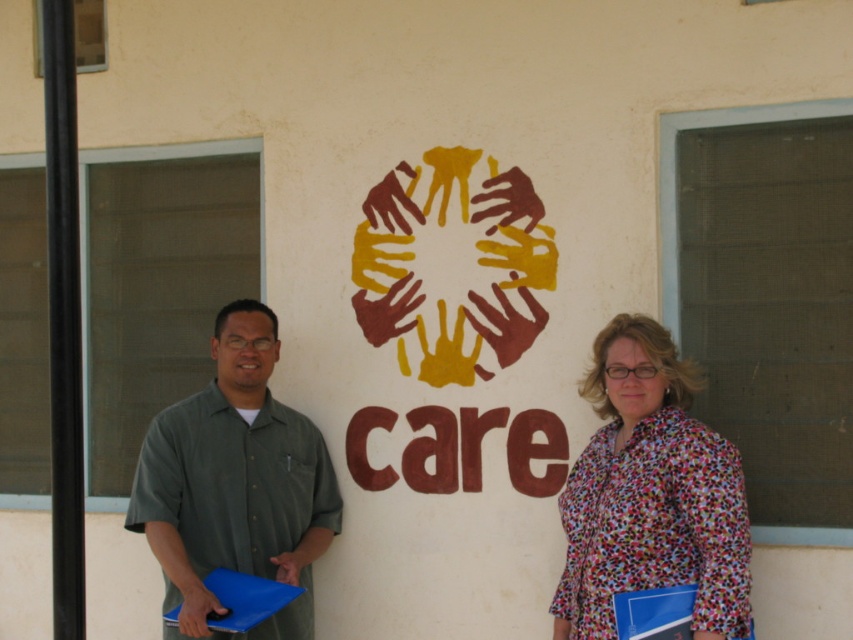
Can you confirm if green shirt at left is taller than green fabric shirt at left?

No.

Can you confirm if green shirt at left is bigger than green fabric shirt at left?

Actually, green shirt at left might be smaller than green fabric shirt at left.

Does point (662, 524) lie in front of point (213, 636)?

Yes, point (662, 524) is closer to viewer.

The height and width of the screenshot is (640, 853). Identify the location of green shirt at left. (651, 493).

Find the location of a particular element. Image resolution: width=853 pixels, height=640 pixels. printed fabric blouse at center is located at coordinates (650, 493).

Who is more forward, (712, 621) or (264, 308)?

Point (712, 621) is more forward.

You are a GUI agent. You are given a task and a screenshot of the screen. Output one action in this format:
    pyautogui.click(x=<x>, y=<y>)
    Task: Click on the printed fabric blouse at center
    The height and width of the screenshot is (640, 853).
    Given the screenshot: What is the action you would take?
    pyautogui.click(x=650, y=493)

Who is more forward, (657,531) or (584,518)?

Point (657,531)

Can you confirm if green shirt at left is thinner than printed fabric blouse at center?

Indeed, green shirt at left has a lesser width compared to printed fabric blouse at center.

What do you see at coordinates (651, 493) in the screenshot?
I see `green shirt at left` at bounding box center [651, 493].

The image size is (853, 640). What are the coordinates of `green shirt at left` in the screenshot? It's located at (651, 493).